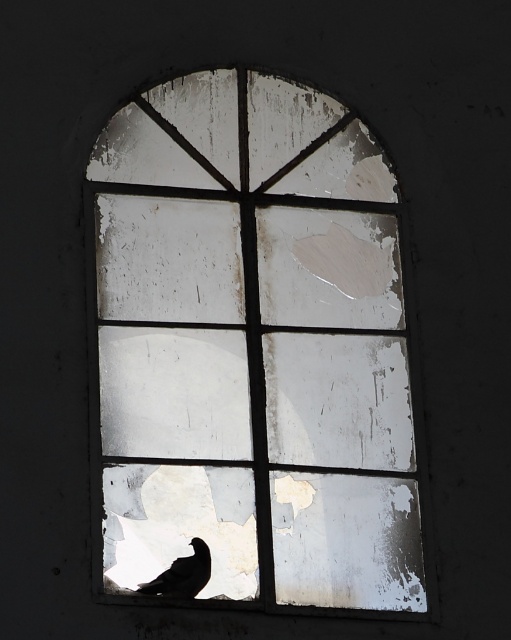
You are standing in front of the window and notice the silhouette feathered bird at lower left and the white peeling paint window at center. Which object is positioned to the left?

The silhouette feathered bird at lower left is positioned to the left of the white peeling paint window at center.